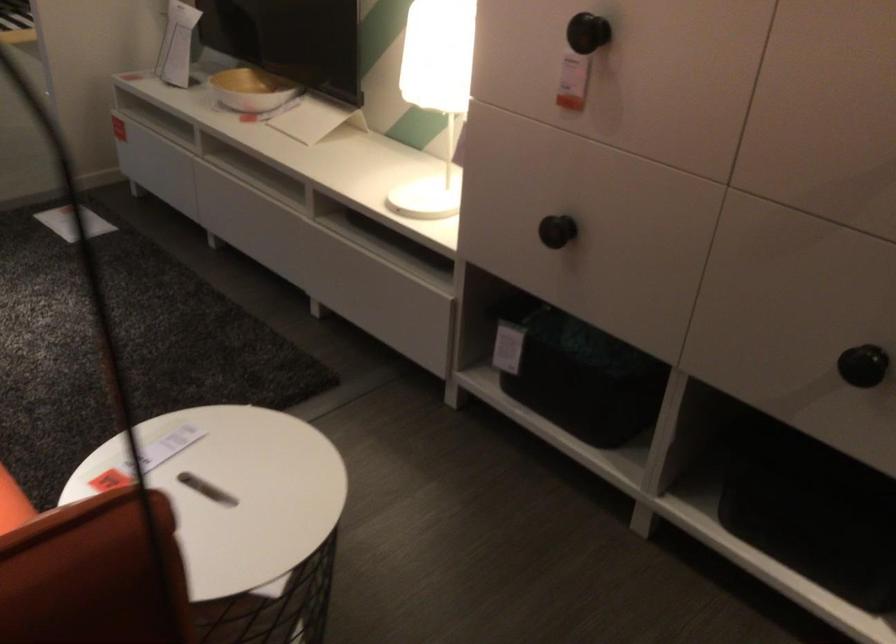
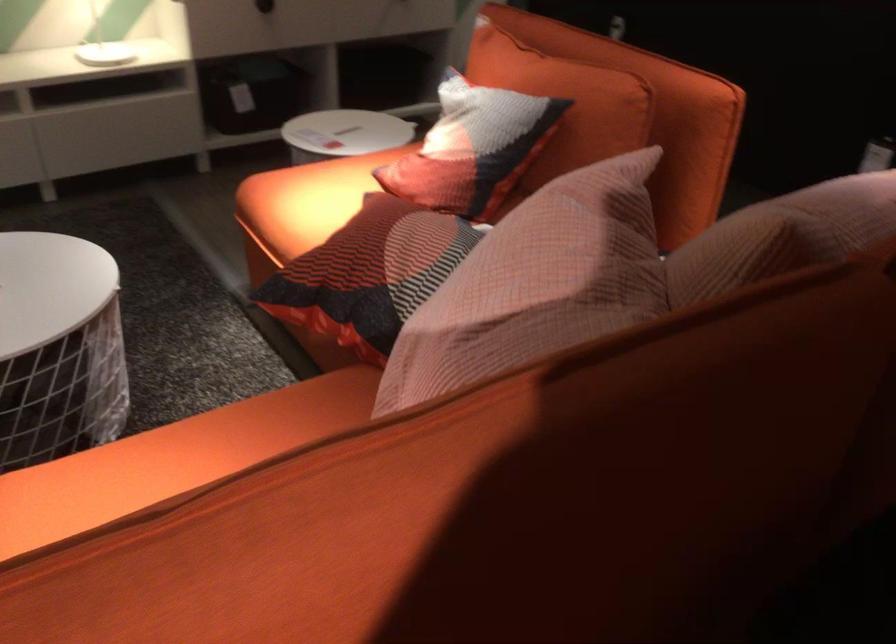
The point at (x=498, y=238) is marked in the first image. Where is the corresponding point in the second image?

(264, 6)